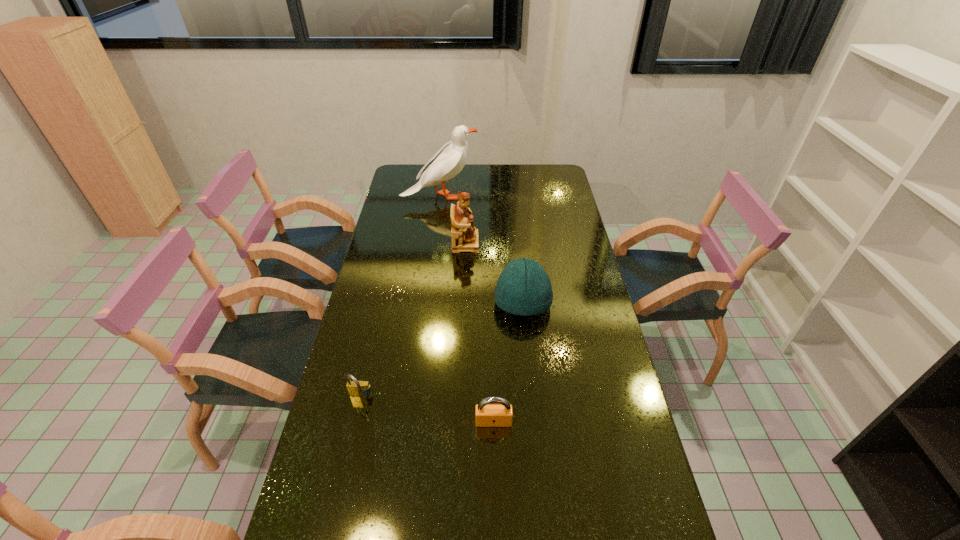
The height and width of the screenshot is (540, 960). I want to click on the farthest object, so click(450, 159).

Find the location of a particular element. This screenshot has height=540, width=960. the tallest object is located at coordinates (450, 159).

You are a GUI agent. You are given a task and a screenshot of the screen. Output one action in this format:
    pyautogui.click(x=<x>, y=<y>)
    Task: Click on the figurine
    
    Given the screenshot: What is the action you would take?
    pyautogui.click(x=464, y=236)

Locate an element on the screen. the second farthest object is located at coordinates (464, 236).

You are a GUI agent. You are given a task and a screenshot of the screen. Output one action in this format:
    pyautogui.click(x=<x>, y=<y>)
    Task: Click on the beanie
    The width and height of the screenshot is (960, 540).
    Given the screenshot: What is the action you would take?
    pyautogui.click(x=523, y=288)

Identify the location of the third shortest object. This screenshot has width=960, height=540. (523, 288).

This screenshot has height=540, width=960. Find the location of `the nearer padlock`. the nearer padlock is located at coordinates (487, 414).

What are the coordinates of `the nearest object` in the screenshot? It's located at (487, 414).

Identify the location of the farther padlock. (356, 388).

Identify the location of the second nearest object. This screenshot has height=540, width=960. (356, 388).